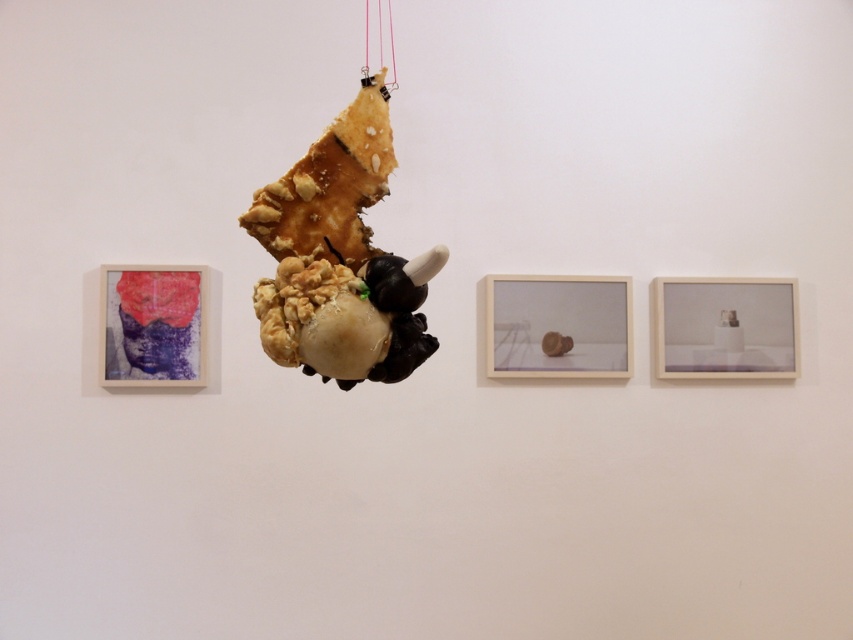
Is point (308, 198) less distant than point (170, 324)?

Yes.

Does golden-brown crumbly pastry at center appear over textured fabric mask at left?

Yes.

Which is in front, point (347, 179) or point (161, 372)?

Point (347, 179)

This screenshot has height=640, width=853. I want to click on golden-brown crumbly pastry at center, so pyautogui.click(x=339, y=257).

Between golden-brown crumbly pastry at center and spongy chocolate cake at center, which one has more height?

Standing taller between the two is golden-brown crumbly pastry at center.

Does golden-brown crumbly pastry at center have a greater height compared to spongy chocolate cake at center?

Indeed, golden-brown crumbly pastry at center has a greater height compared to spongy chocolate cake at center.

Image resolution: width=853 pixels, height=640 pixels. I want to click on golden-brown crumbly pastry at center, so click(339, 257).

Based on the photo, does spongy chocolate cake at center appear on the left side of textured fabric mask at left?

No, spongy chocolate cake at center is not to the left of textured fabric mask at left.

This screenshot has width=853, height=640. What do you see at coordinates (347, 316) in the screenshot? I see `spongy chocolate cake at center` at bounding box center [347, 316].

Which is behind, point (401, 320) or point (105, 264)?

Point (105, 264)

I want to click on spongy chocolate cake at center, so click(347, 316).